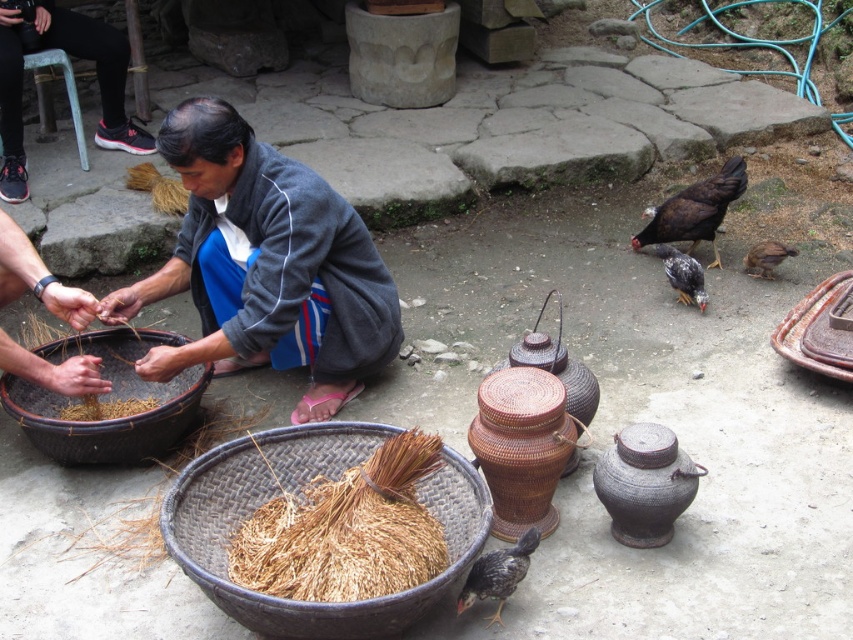
Is brown woven basket at lower center to the right of brown straw at lower left from the viewer's perspective?

Indeed, brown woven basket at lower center is positioned on the right side of brown straw at lower left.

Is brown woven basket at lower center taller than brown straw at lower left?

Correct, brown woven basket at lower center is much taller as brown straw at lower left.

Does point (300, 429) come in front of point (144, 403)?

Yes, point (300, 429) is in front of point (144, 403).

The height and width of the screenshot is (640, 853). Identify the location of brown woven basket at lower center. (300, 497).

The width and height of the screenshot is (853, 640). What are the coordinates of `gray woven fabric at center` in the screenshot? It's located at (265, 266).

Can you confirm if gray woven fabric at center is shorter than brown straw at lower left?

No, gray woven fabric at center is not shorter than brown straw at lower left.

Which is in front, point (283, 262) or point (126, 413)?

Point (283, 262)

You are a GUI agent. You are given a task and a screenshot of the screen. Output one action in this format:
    pyautogui.click(x=<x>, y=<y>)
    Task: Click on the gray woven fabric at center
    This screenshot has width=853, height=640.
    Given the screenshot: What is the action you would take?
    pyautogui.click(x=265, y=266)

Is gray woven fabric at center below woven brown pot at center?

Incorrect, gray woven fabric at center is not positioned below woven brown pot at center.

Does gray woven fabric at center have a greater width compared to woven brown pot at center?

Correct, the width of gray woven fabric at center exceeds that of woven brown pot at center.

Locate an element on the screen. Image resolution: width=853 pixels, height=640 pixels. gray woven fabric at center is located at coordinates (265, 266).

You are a GUI agent. You are given a task and a screenshot of the screen. Output one action in this format:
    pyautogui.click(x=<x>, y=<y>)
    Task: Click on the gray woven fabric at center
    
    Given the screenshot: What is the action you would take?
    pyautogui.click(x=265, y=266)